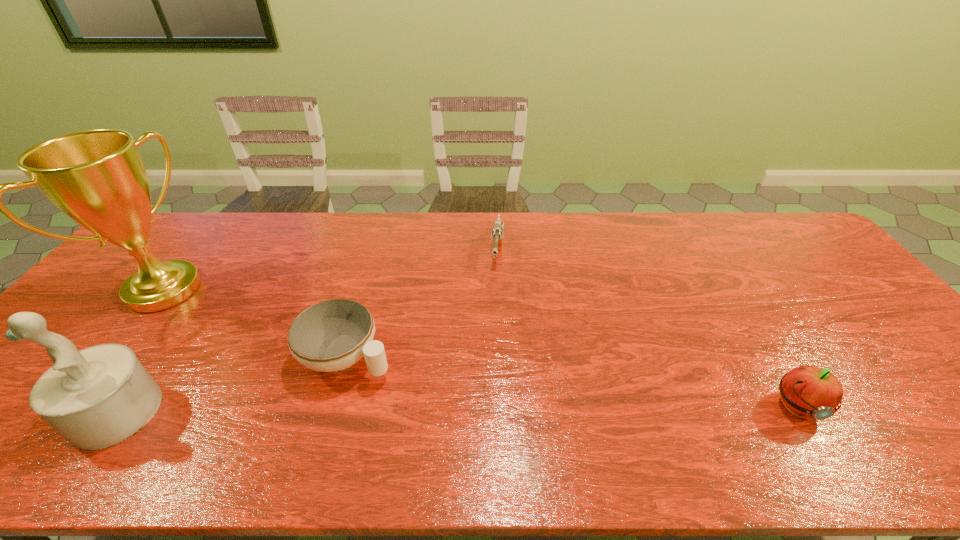
This screenshot has height=540, width=960. In order to click on free space that is in between the rightmost object and the award in this screenshot , I will do `click(480, 348)`.

Find the location of a particular element. This screenshot has height=540, width=960. empty space that is in between the third object from left to right and the figurine is located at coordinates (232, 384).

At what (x,y) coordinates should I click in order to perform the action: click on free space between the tallest object and the figurine. Please return your answer as a coordinate pair (x, y). This screenshot has width=960, height=540. Looking at the image, I should click on (140, 351).

You are a GUI agent. You are given a task and a screenshot of the screen. Output one action in this format:
    pyautogui.click(x=<x>, y=<y>)
    Task: Click on the free space between the chinaware and the apple
    Image resolution: width=960 pixels, height=540 pixels.
    Given the screenshot: What is the action you would take?
    pyautogui.click(x=571, y=381)

I want to click on free point between the rightmost object and the figurine, so click(x=457, y=409).

Locate which object is the second closest to the apple. Please provide its 2D coordinates. Your answer should be formatted as a tuple, i.e. [(x, y)], where the tuple contains the x and y coordinates of a point satisfying the conditions above.

[(332, 335)]

Image resolution: width=960 pixels, height=540 pixels. Identify the location of object that ranks as the third closest to the award. (497, 232).